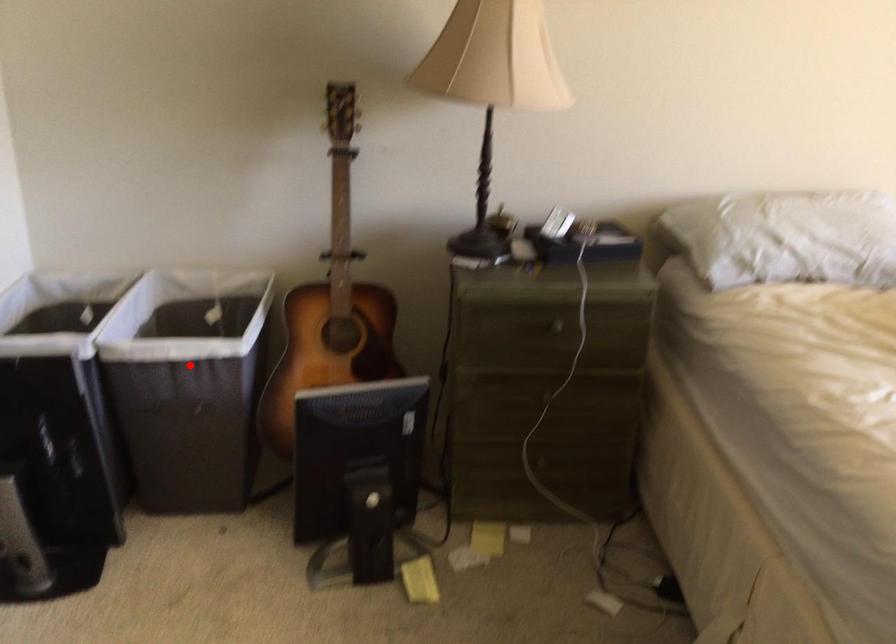
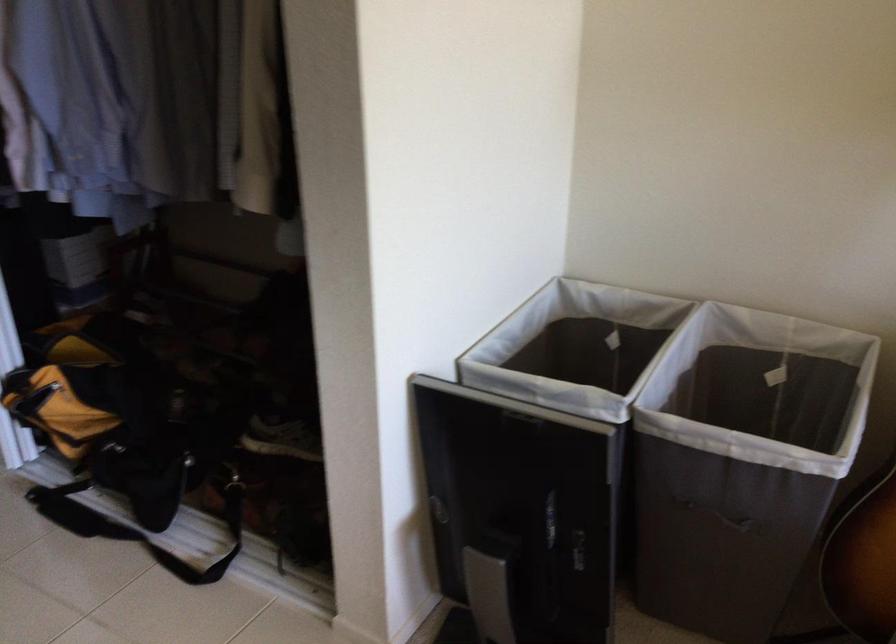
Question: A red point is marked in image1. In image2, is the corresponding 3D point closer to the camera or farther? Reply with the corresponding letter.

Choices:
 (A) The corresponding 3D point is closer.
 (B) The corresponding 3D point is farther.

Answer: (A)